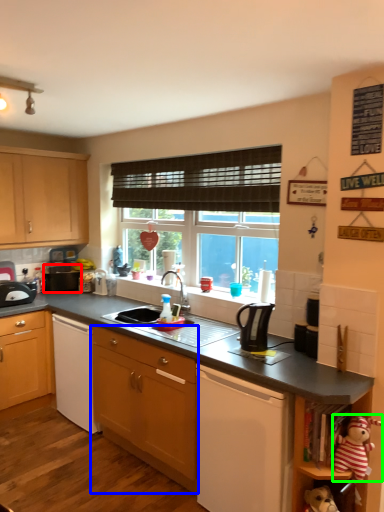
Question: Which is farther away from appliance (highlighted by a red box)? cabinetry (highlighted by a blue box) or toy (highlighted by a green box)?

Choices:
 (A) cabinetry
 (B) toy

Answer: (B)